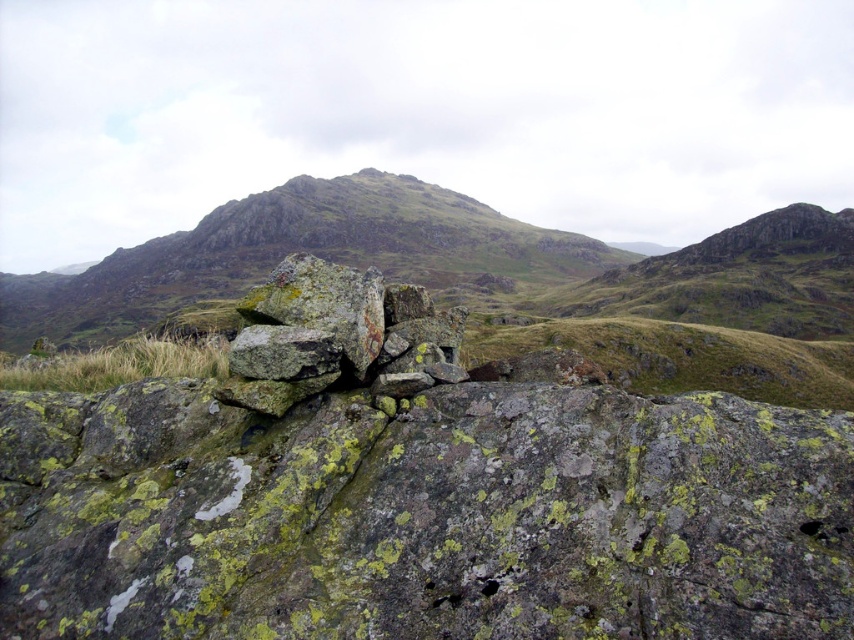
You are a hiker navigating through the rugged landscape. You notice the rusty metallic pile at center and the rusty stone boulders at center. Which object is closer to you?

The rusty metallic pile at center is closer to the viewer than the rusty stone boulders at center.